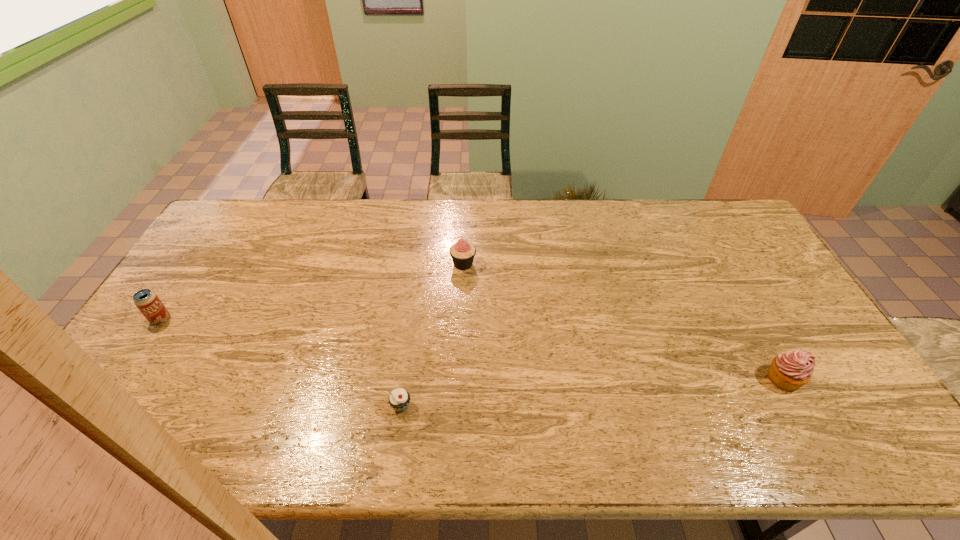
Find the location of `empty space that is in between the beer can and the second nearest object`. empty space that is in between the beer can and the second nearest object is located at coordinates (472, 349).

Identify which object is the second closest to the second cupcake from right to left. Please provide its 2D coordinates. Your answer should be formatted as a tuple, i.e. [(x, y)], where the tuple contains the x and y coordinates of a point satisfying the conditions above.

[(147, 301)]

Locate an element on the screen. object identified as the closest to the nearest object is located at coordinates (462, 253).

Identify the location of cupcake that is the closest to the rightmost cupcake. The height and width of the screenshot is (540, 960). (462, 253).

Where is `cupcake that is the closest to the shortest cupcake`? The height and width of the screenshot is (540, 960). cupcake that is the closest to the shortest cupcake is located at coordinates (462, 253).

Find the location of a particular element. The height and width of the screenshot is (540, 960). free spot that satisfies the following two spatial constraints: 1. on the back side of the third object from left to right; 2. on the right side of the nearest cupcake is located at coordinates (420, 264).

Locate an element on the screen. The height and width of the screenshot is (540, 960). free spot that satisfies the following two spatial constraints: 1. on the front side of the nearest cupcake; 2. on the left side of the second farthest object is located at coordinates (103, 407).

The height and width of the screenshot is (540, 960). What are the coordinates of `free location that satisfies the following two spatial constraints: 1. on the back side of the rightmost cupcake; 2. on the right side of the second object from left to right` in the screenshot? It's located at click(405, 379).

Where is `free space that satisfies the following two spatial constraints: 1. on the front side of the farthest object; 2. on the left side of the rightmost object`? The image size is (960, 540). free space that satisfies the following two spatial constraints: 1. on the front side of the farthest object; 2. on the left side of the rightmost object is located at coordinates (459, 379).

Identify the location of vacant point that satisfies the following two spatial constraints: 1. on the back side of the second cupcake from left to right; 2. on the right side of the second object from left to right. (420, 264).